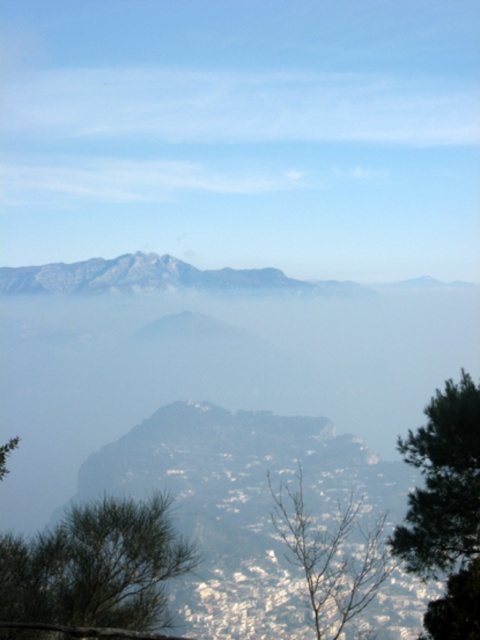
You are standing at the base of the mountain and see two points marked in the image. The first point is at coordinates point (136, 508), and the second is at point (324, 608). Which point is closer to you?

Point (136, 508) is in front of point (324, 608), so it is closer to you.

You are standing at the camera position looking at the mountain scene. There are two points marked in the image, one at coordinates point (84, 561) and the other at point (452, 417). Which of these two points is nearer to you?

Point (84, 561) is closer to the camera than point (452, 417), so the point at coordinates point (84, 561) is nearer to you.